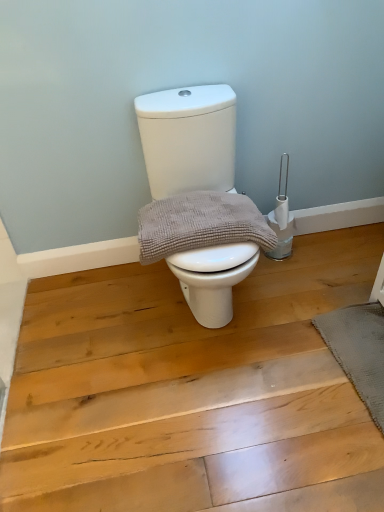
Question: From a real-world perspective, relative to white glossy toilet at center, is gray textured towel at center vertically above or below?

Choices:
 (A) below
 (B) above

Answer: (B)

Question: In terms of size, does gray textured towel at center appear bigger or smaller than white glossy toilet at center?

Choices:
 (A) big
 (B) small

Answer: (B)

Question: Considering the real-world distances, which object is farthest from the gray textured bath mat at lower right?

Choices:
 (A) white glossy toilet at center
 (B) gray textured towel at center

Answer: (A)

Question: Estimate the real-world distances between objects in this image. Which object is farther from the white glossy toilet at center?

Choices:
 (A) gray textured towel at center
 (B) gray textured bath mat at lower right

Answer: (B)